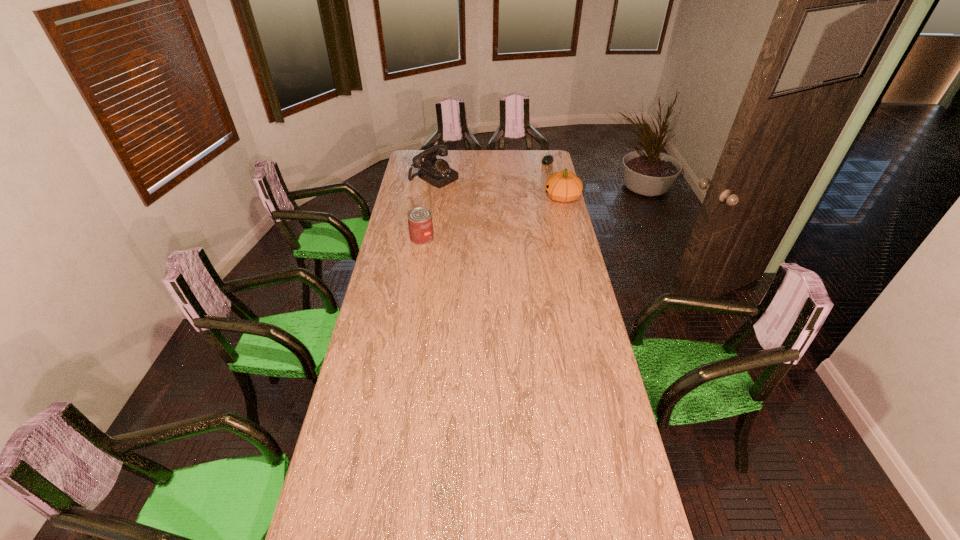
The height and width of the screenshot is (540, 960). Find the location of `vacant space that satisfies the following two spatial constraints: 1. on the back side of the computer mouse; 2. on the right side of the second shortest object`. vacant space that satisfies the following two spatial constraints: 1. on the back side of the computer mouse; 2. on the right side of the second shortest object is located at coordinates (434, 161).

Where is `vacant space that satisfies the following two spatial constraints: 1. on the back side of the computer mouse; 2. on the left side of the second shortest object`? The image size is (960, 540). vacant space that satisfies the following two spatial constraints: 1. on the back side of the computer mouse; 2. on the left side of the second shortest object is located at coordinates (434, 161).

Identify the location of free space that satisfies the following two spatial constraints: 1. on the back side of the can; 2. on the right side of the telephone. This screenshot has width=960, height=540. (432, 178).

The height and width of the screenshot is (540, 960). In order to click on vacant space that satisfies the following two spatial constraints: 1. on the back side of the can; 2. on the side of the gourd with the carved face in this screenshot , I will do `click(428, 197)`.

You are a GUI agent. You are given a task and a screenshot of the screen. Output one action in this format:
    pyautogui.click(x=<x>, y=<y>)
    Task: Click on the blank area in the image that satisfies the following two spatial constraints: 1. on the back side of the can; 2. on the left side of the telephone
    The height and width of the screenshot is (540, 960).
    Given the screenshot: What is the action you would take?
    pyautogui.click(x=432, y=178)

At what (x,y) coordinates should I click in order to perform the action: click on vacant space that satisfies the following two spatial constraints: 1. on the back side of the computer mouse; 2. on the left side of the third tallest object. Please return your answer as a coordinate pair (x, y). Looking at the image, I should click on (434, 161).